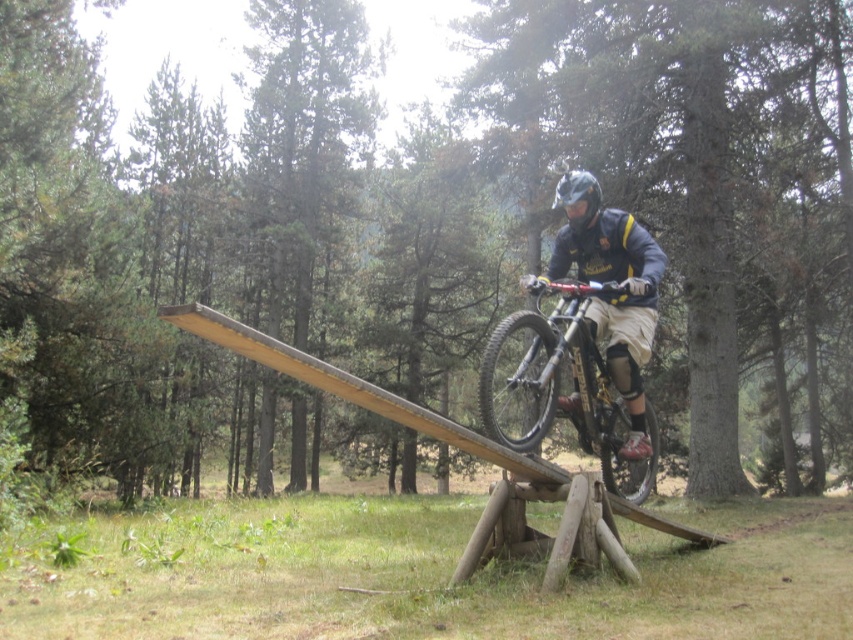
Describe the element at coordinates (560, 387) in the screenshot. This screenshot has height=640, width=853. I see `shiny metallic bicycle at center` at that location.

Looking at this image, does shiny metallic bicycle at center have a lesser width compared to matte black helmet at center?

No.

Image resolution: width=853 pixels, height=640 pixels. Describe the element at coordinates (560, 387) in the screenshot. I see `shiny metallic bicycle at center` at that location.

I want to click on shiny metallic bicycle at center, so click(x=560, y=387).